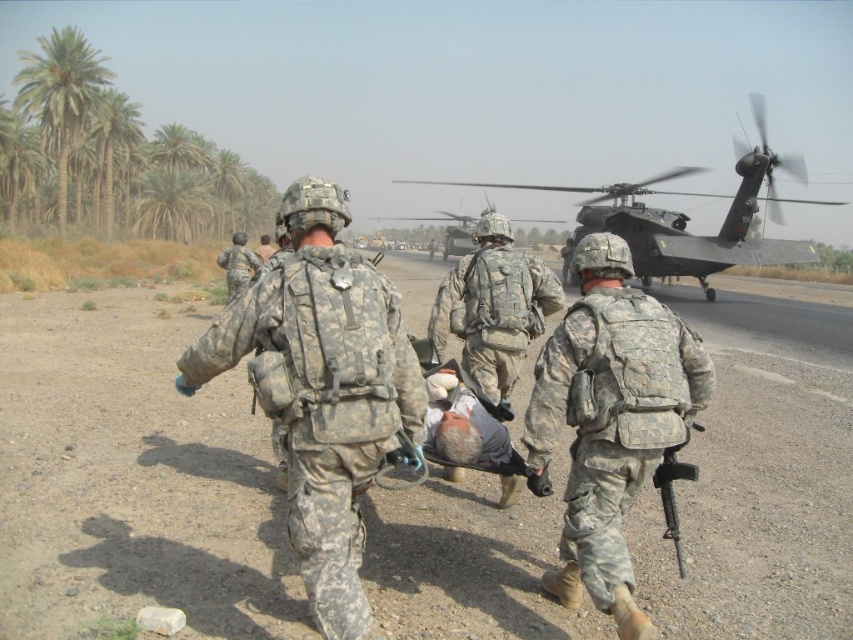
You are a soldier in the desert. You see a camouflage fabric uniform at center and a green leafy palm tree at upper left. Which object is closer to you?

The camouflage fabric uniform at center is closer to you because it is in front of the green leafy palm tree at upper left.

You are a soldier carrying a camouflage fabric backpack at center while moving along a dirt road. You notice a dark gray matte helicopter at center above you. Based on your position, can you see the helicopter directly overhead?

Yes, the camouflage fabric backpack at center is positioned under the dark gray matte helicopter at center, so you can see the helicopter directly overhead.